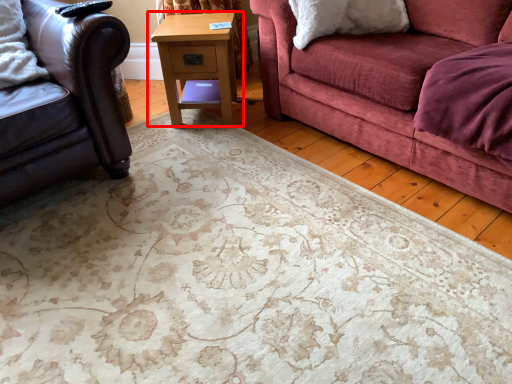
Question: In this image, where is table (annotated by the red box) located relative to studio couch?

Choices:
 (A) left
 (B) right

Answer: (B)